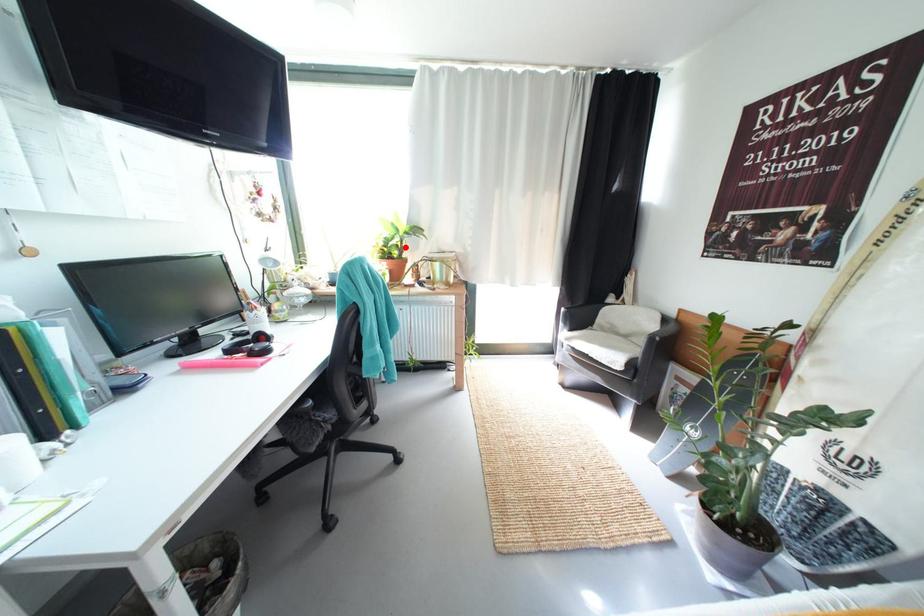
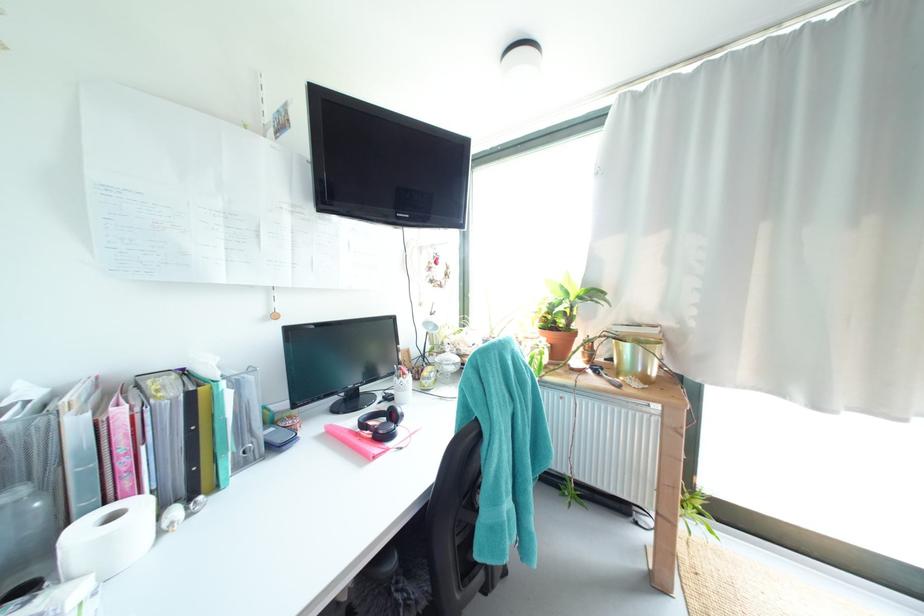
Find the pixel in the second image that matches the highlighted location in the first image.

(573, 315)